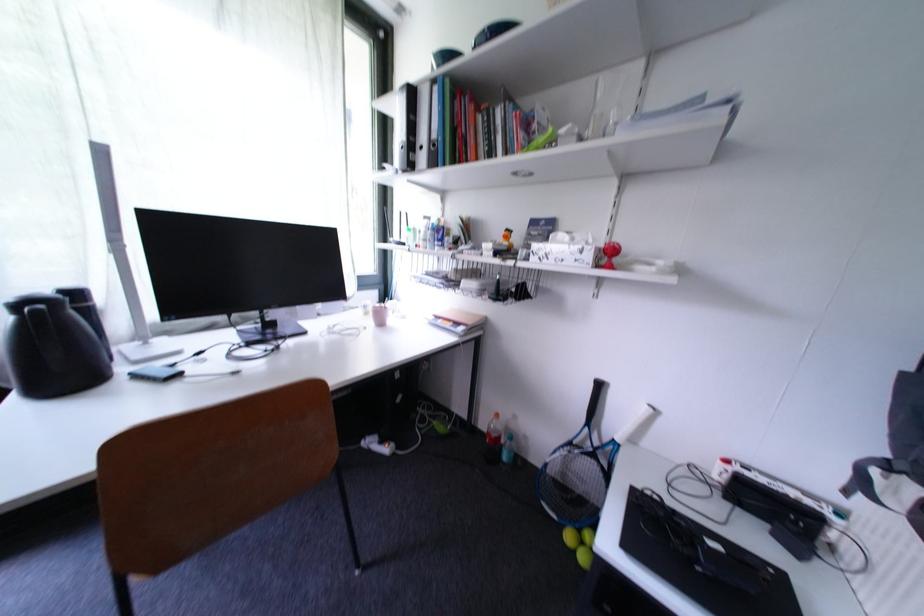
Which object does [448,122] point to?

It refers to a green ring binder.